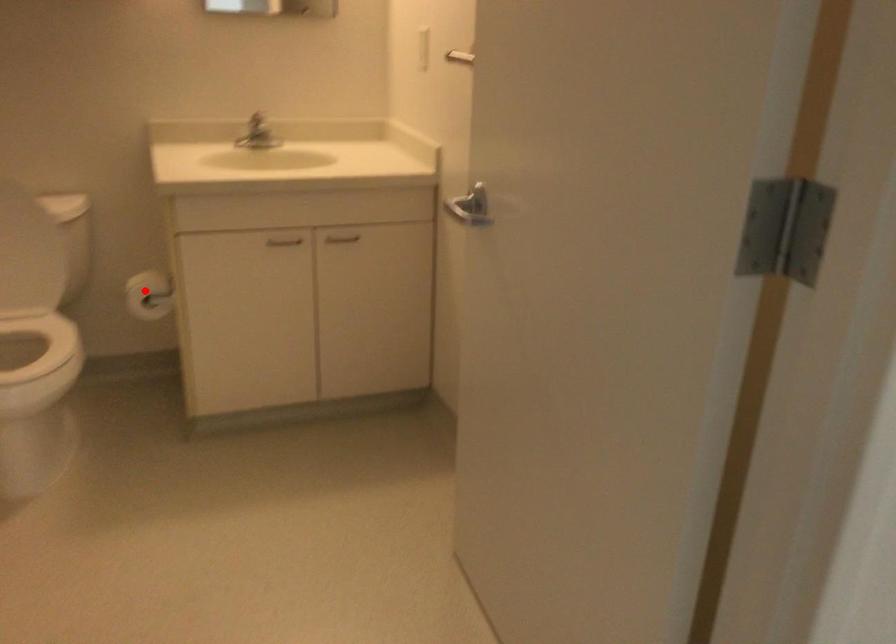
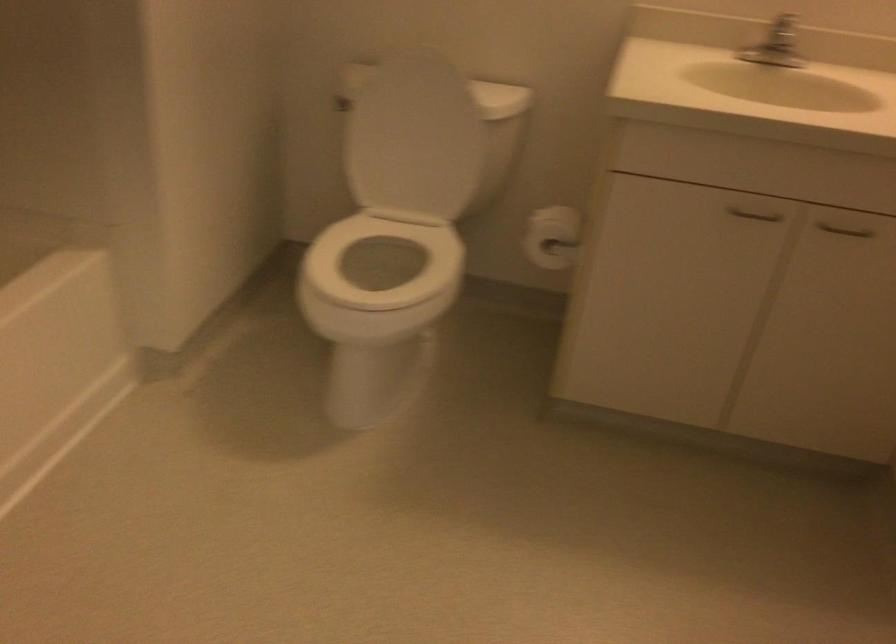
Where in the second image is the point corresponding to the highlighted location from the first image?

(552, 237)